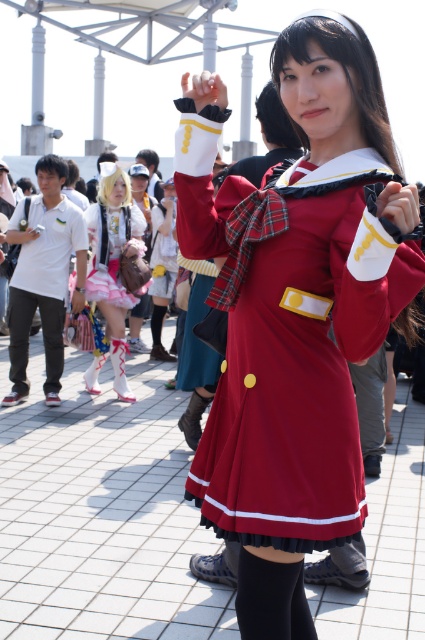
You are a photographer at a cosplay event. You want to take a photo of the matte red dress at center and the black cotton pants at left together in the same frame. Given that your camera has a maximum focus range of 5 meters, will you be able to capture both subjects in focus?

The distance between the matte red dress at center and the black cotton pants at left is 5.55 meters, which exceeds the camera maximum focus range of 5 meters. Therefore, you cannot capture both subjects in focus.

You are a photographer at the event and want to capture both the white matte shirt at left and the pastel pink fabric dress at center in your shot. Which object should you focus on first to ensure both are in frame?

You should focus on the pastel pink fabric dress at center first since the white matte shirt at left is shorter in height, allowing the dress to be more central and ensure both are in frame.